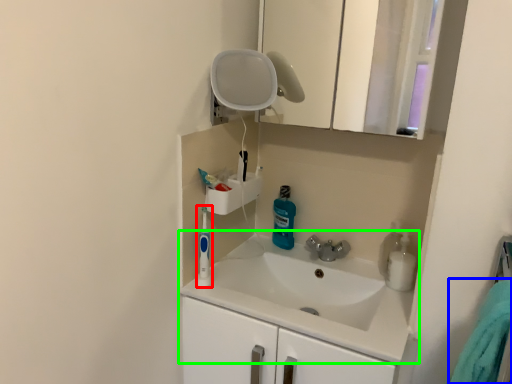
Question: Based on their relative distances, which object is farther from toiletry (highlighted by a red box)? Choose from bath towel (highlighted by a blue box) and sink (highlighted by a green box).

Choices:
 (A) bath towel
 (B) sink

Answer: (A)